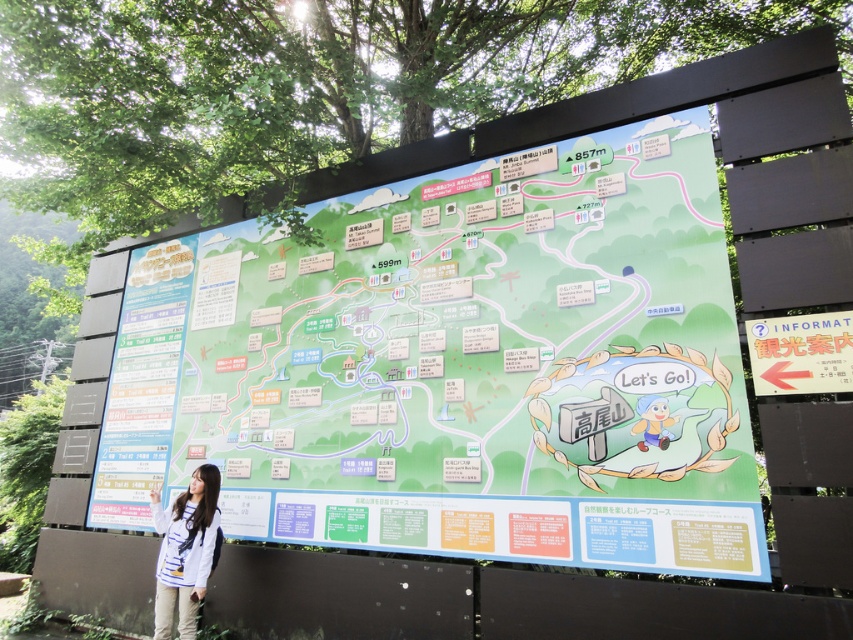
You are standing in front of the map and see the white striped shirt at lower left and the matte red sign at right. Which object is closer to you?

The white striped shirt at lower left is closer to you because it is in front of the matte red sign at right.